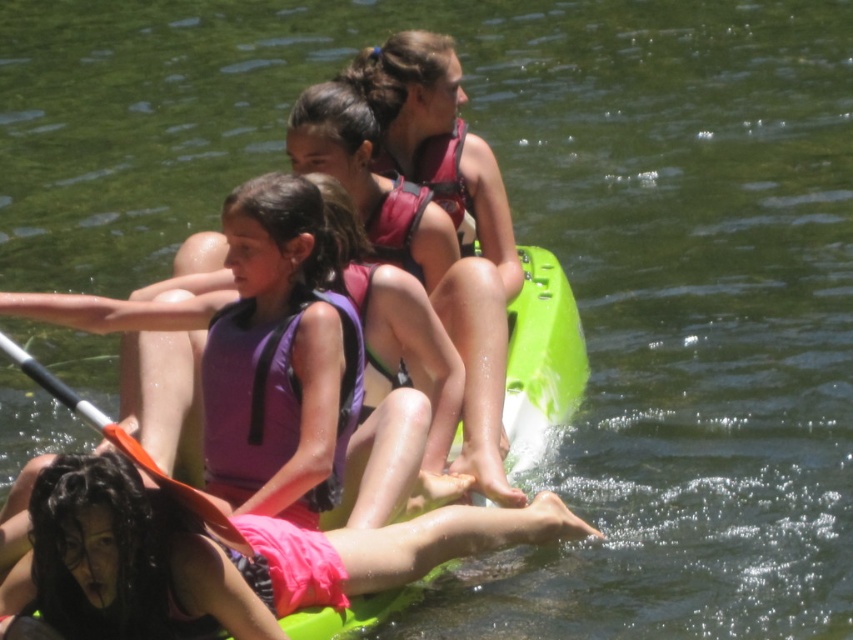
Can you confirm if pink fabric life vest at lower center is wider than matte pink life jacket at center?

Correct, the width of pink fabric life vest at lower center exceeds that of matte pink life jacket at center.

Between point (164, 529) and point (453, 186), which one is positioned behind?

Positioned behind is point (453, 186).

Locate an element on the screen. The height and width of the screenshot is (640, 853). pink fabric life vest at lower center is located at coordinates (230, 556).

Who is taller, purple fabric life jacket at center or matte pink life jacket at center?

With more height is purple fabric life jacket at center.

Describe the element at coordinates (248, 400) in the screenshot. I see `purple fabric life jacket at center` at that location.

Is point (212, 317) positioned after point (436, 141)?

No.

Locate an element on the screen. This screenshot has height=640, width=853. purple fabric life jacket at center is located at coordinates (248, 400).

Can you confirm if purple fabric life jacket at center is positioned below orange paddle at center?

Actually, purple fabric life jacket at center is above orange paddle at center.

Who is shorter, purple fabric life jacket at center or orange paddle at center?

orange paddle at center

Between point (252, 433) and point (154, 461), which one is positioned in front?

Point (154, 461)

The width and height of the screenshot is (853, 640). I want to click on purple fabric life jacket at center, so click(x=248, y=400).